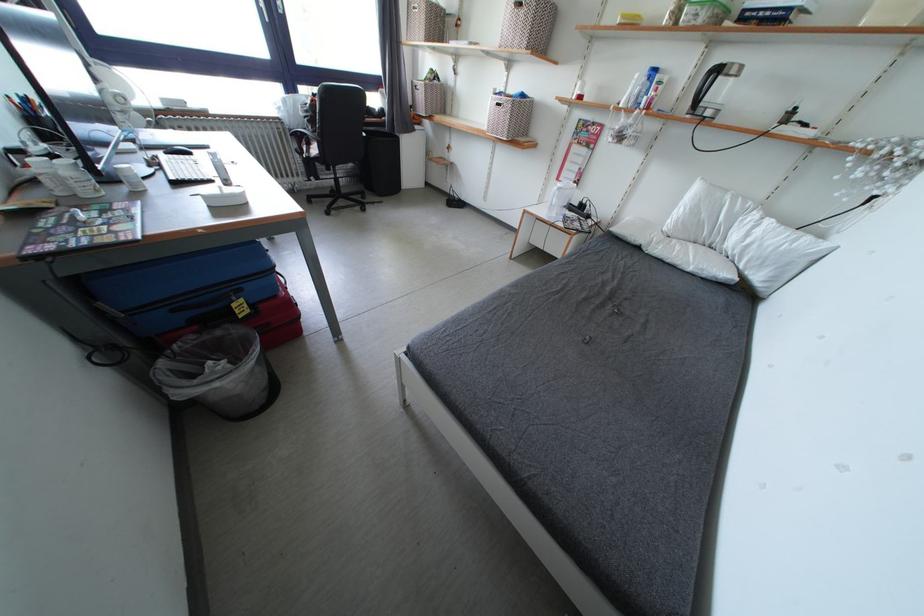
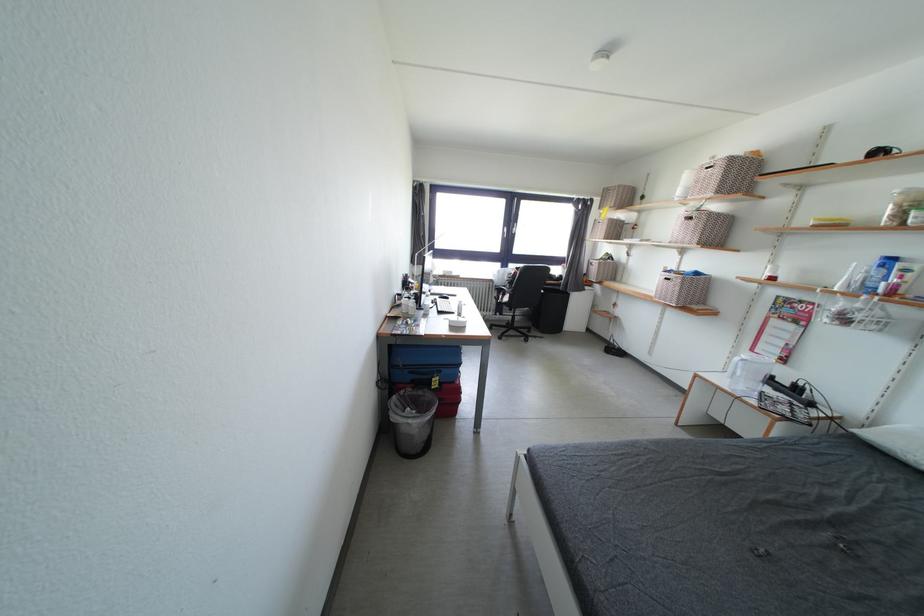
The point at (x=409, y=119) is marked in the first image. Where is the corresponding point in the second image?

(584, 284)